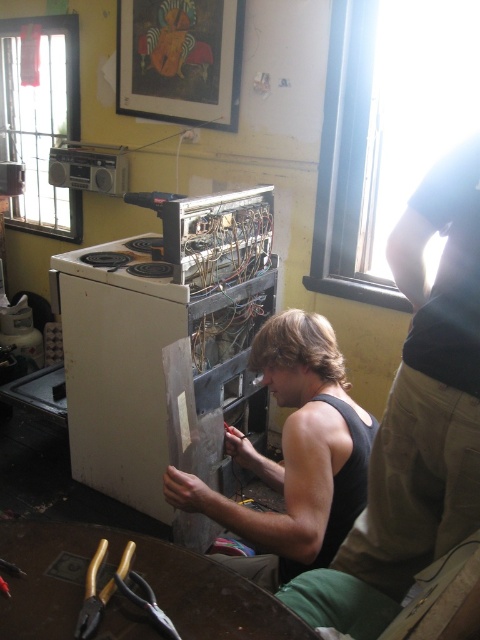
You are a repair technician who needs to reach both the black matte tank top at center and the gold metallic pliers at lower left during a repair task. What is the minimum distance you need to move to grab both items?

The minimum distance you need to move to grab both the black matte tank top at center and the gold metallic pliers at lower left is 21.20 inches, as they are 21.20 inches apart from each other.

You are a customer in a repair shop and see the black tank top at center and the gold metallic pliers at lower left. Which object is taller?

The black tank top at center is much taller than the gold metallic pliers at lower left.

You are a tailor trying to decide whether to place a new decorative pin on the black matte tank top at center or the gold metallic pliers at lower left. Which object has a larger width to accommodate the pin?

The black matte tank top at center might be wider than gold metallic pliers at lower left, so the black matte tank top at center is more suitable for placing the decorative pin due to its potentially larger width.